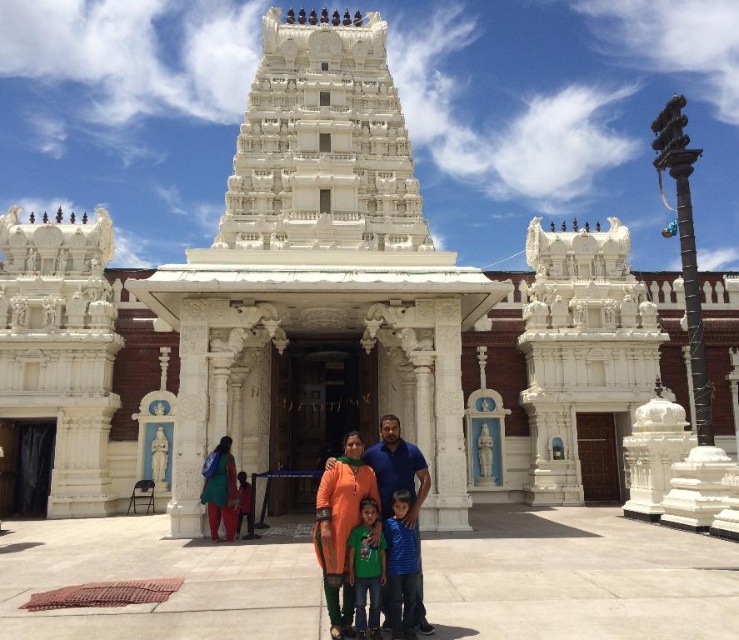
Question: Is white marble hindu temple at center in front of dark orange fabric at center?

Choices:
 (A) yes
 (B) no

Answer: (A)

Question: Which point appears closest to the camera in this image?

Choices:
 (A) (408, 588)
 (B) (236, 531)
 (C) (289, 276)
 (D) (367, 586)

Answer: (D)

Question: Is white marble hindu temple at center below orange fabric family at center?

Choices:
 (A) yes
 (B) no

Answer: (B)

Question: Can you confirm if white marble hindu temple at center is positioned below blue striped shirt at center?

Choices:
 (A) no
 (B) yes

Answer: (A)

Question: Which point is closer to the camera taking this photo?

Choices:
 (A) (372, 620)
 (B) (245, 500)
 (C) (391, 561)

Answer: (A)

Question: Estimate the real-world distances between objects in this image. Which object is closer to the dark orange fabric at center?

Choices:
 (A) white marble hindu temple at center
 (B) green cotton shirt at center
 (C) blue striped shirt at center

Answer: (B)